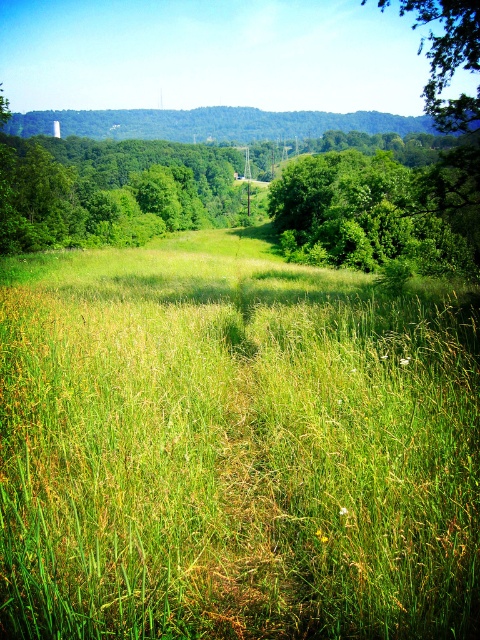
Does green grassy field at center appear on the right side of green leafy tree at center?

Incorrect, green grassy field at center is not on the right side of green leafy tree at center.

Which is in front, point (317, 484) or point (420, 264)?

Point (317, 484)

Where is `green grassy field at center`? This screenshot has width=480, height=640. green grassy field at center is located at coordinates (233, 449).